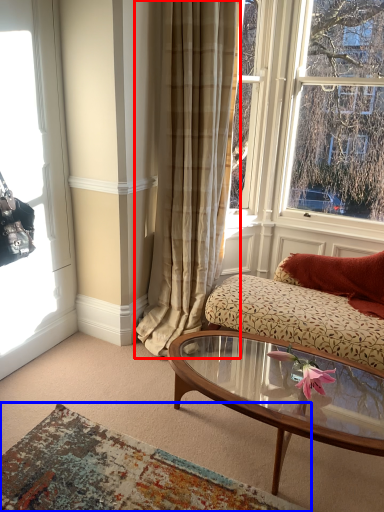
Question: Among these objects, which one is nearest to the camera, curtain (highlighted by a red box) or plain (highlighted by a blue box)?

Choices:
 (A) curtain
 (B) plain

Answer: (B)